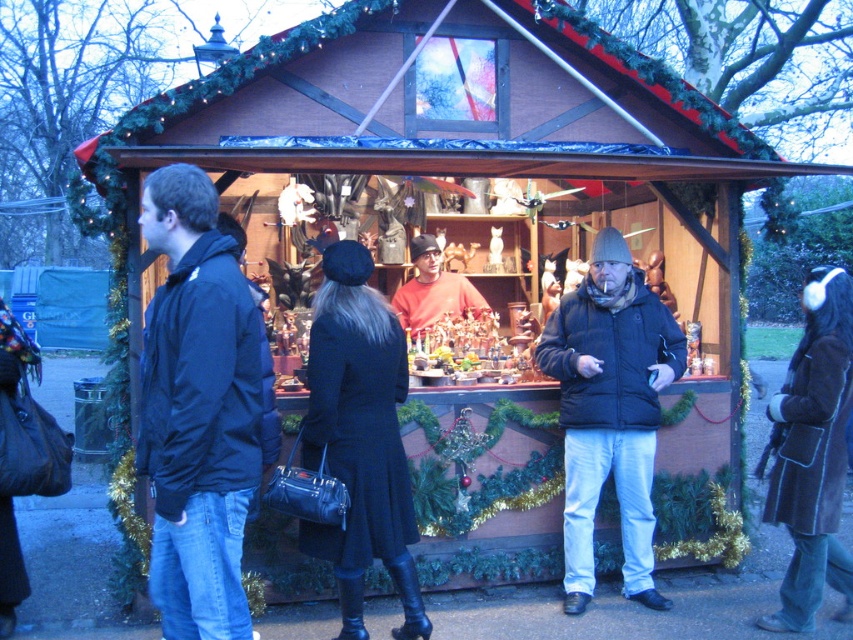
Question: Estimate the real-world distances between objects in this image. Which object is farther from the matte orange sweater at center?

Choices:
 (A) brown suede coat at lower right
 (B) dark blue leather coat at center
 (C) dark blue jacket at left

Answer: (C)

Question: Which point appears closest to the camera in this image?

Choices:
 (A) (576, 323)
 (B) (813, 317)
 (C) (386, 449)

Answer: (C)

Question: Considering the relative positions of black matte jacket at center and dark blue leather coat at center in the image provided, where is black matte jacket at center located with respect to dark blue leather coat at center?

Choices:
 (A) above
 (B) below

Answer: (A)

Question: Can you confirm if black matte jacket at center is smaller than brown suede coat at lower right?

Choices:
 (A) no
 (B) yes

Answer: (A)

Question: Which point is farther to the camera?

Choices:
 (A) dark blue leather coat at center
 (B) black matte jacket at center
 (C) brown suede coat at lower right

Answer: (B)

Question: Is dark blue jacket at left in front of brown suede coat at lower right?

Choices:
 (A) no
 (B) yes

Answer: (B)